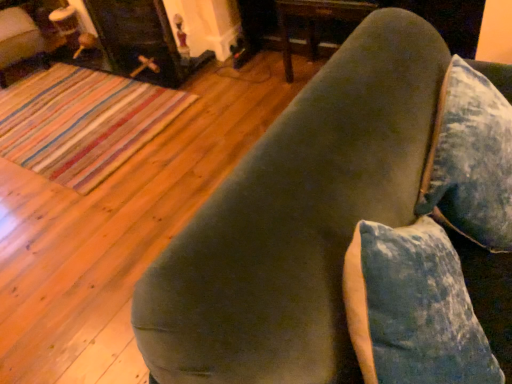
Question: Is point (175, 44) positioned closer to the camera than point (490, 198)?

Choices:
 (A) farther
 (B) closer

Answer: (A)

Question: In the image, is matte black fireplace at upper left on the left side or the right side of velvet green couch at upper right?

Choices:
 (A) right
 (B) left

Answer: (B)

Question: Is matte black fireplace at upper left inside the boundaries of velvet green couch at upper right, or outside?

Choices:
 (A) inside
 (B) outside

Answer: (B)

Question: Considering their positions, is velvet green couch at upper right located in front of or behind matte black fireplace at upper left?

Choices:
 (A) behind
 (B) front

Answer: (B)

Question: Based on their positions, is velvet green couch at upper right located to the left or right of matte black fireplace at upper left?

Choices:
 (A) left
 (B) right

Answer: (B)

Question: Based on their sizes in the image, would you say velvet green couch at upper right is bigger or smaller than matte black fireplace at upper left?

Choices:
 (A) small
 (B) big

Answer: (A)

Question: Is point [423, 34] closer or farther from the camera than point [88, 6]?

Choices:
 (A) closer
 (B) farther

Answer: (A)